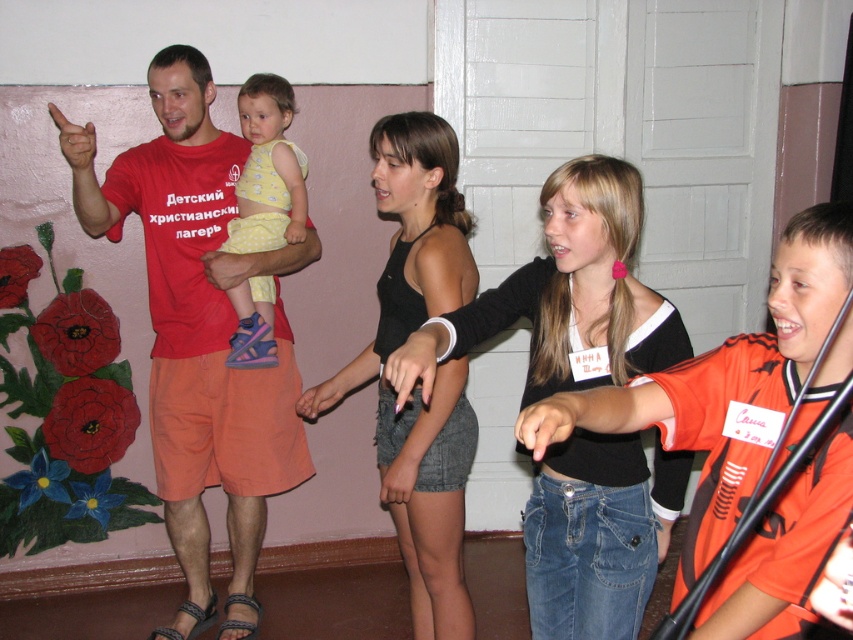
Question: Which point appears farthest from the camera in this image?

Choices:
 (A) (607, 584)
 (B) (281, 260)

Answer: (B)

Question: Estimate the real-world distances between objects in this image. Which object is farther from the jeans at center?

Choices:
 (A) matte red t-shirt at center
 (B) black cotton tank top at center
 (C) yellow dotted fabric at center
 (D) denim shorts at center

Answer: (C)

Question: Which object is positioned farthest from the black cotton tank top at center?

Choices:
 (A) matte red t-shirt at center
 (B) denim shorts at center

Answer: (A)

Question: In this image, where is matte red t-shirt at center located relative to denim shorts at center?

Choices:
 (A) left
 (B) right

Answer: (A)

Question: Does matte red t-shirt at center appear on the right side of black cotton tank top at center?

Choices:
 (A) yes
 (B) no

Answer: (B)

Question: Can you confirm if matte red t-shirt at center is bigger than yellow dotted fabric at center?

Choices:
 (A) no
 (B) yes

Answer: (B)